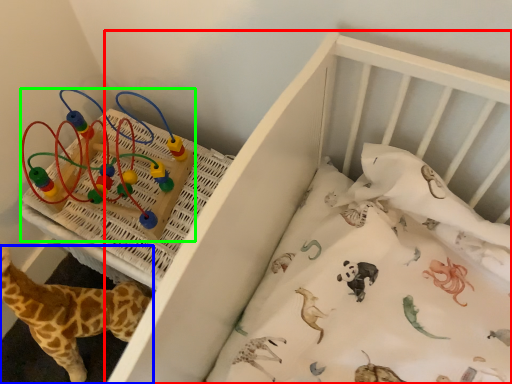
Question: Which object is positioned closest to infant bed (highlighted by a red box)? Select from giraffe (highlighted by a blue box) and toy (highlighted by a green box).

Choices:
 (A) giraffe
 (B) toy

Answer: (B)